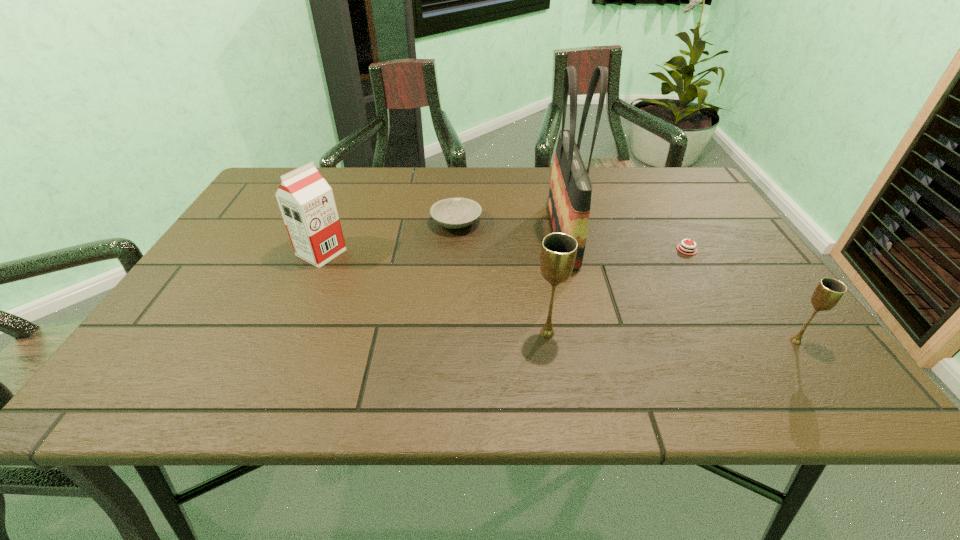
Find the location of `vacant area that satisfies the following two spatial constraints: 1. on the back side of the soya milk; 2. on the right side of the second object from right to left`. vacant area that satisfies the following two spatial constraints: 1. on the back side of the soya milk; 2. on the right side of the second object from right to left is located at coordinates (323, 249).

Find the location of a particular element. The height and width of the screenshot is (540, 960). vacant space that satisfies the following two spatial constraints: 1. on the back side of the shortest object; 2. on the front-facing side of the third object from right to left is located at coordinates (678, 234).

Where is `free space that satisfies the following two spatial constraints: 1. on the front-facing side of the shopping bag; 2. on the front side of the leftmost object`? The width and height of the screenshot is (960, 540). free space that satisfies the following two spatial constraints: 1. on the front-facing side of the shopping bag; 2. on the front side of the leftmost object is located at coordinates (567, 253).